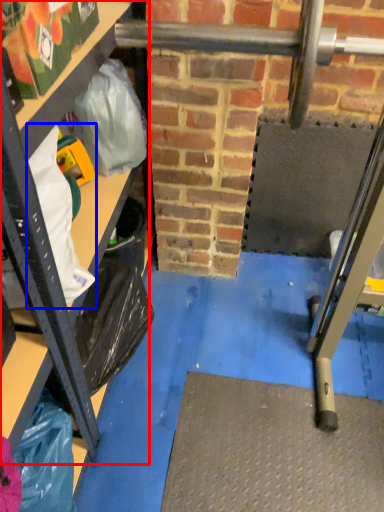
Question: Among these objects, which one is farthest to the camera, shelf (highlighted by a red box) or grocery bag (highlighted by a blue box)?

Choices:
 (A) shelf
 (B) grocery bag

Answer: (B)